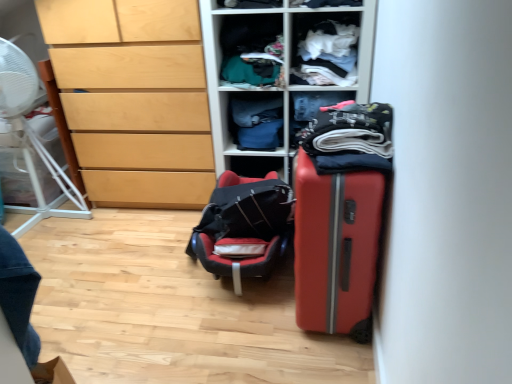
You are a GUI agent. You are given a task and a screenshot of the screen. Output one action in this format:
    pyautogui.click(x=<x>, y=<y>)
    Task: Click on the free location in front of black fabric backpack at center
    The width and height of the screenshot is (512, 384).
    Given the screenshot: What is the action you would take?
    pyautogui.click(x=216, y=341)